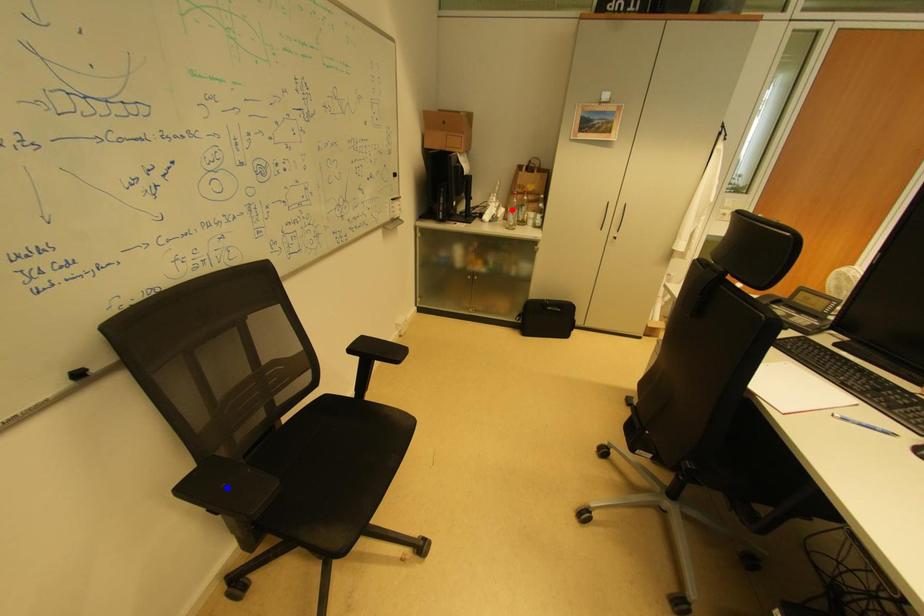
Question: Which of the two points in the image is closer to the camera?

Choices:
 (A) Blue point is closer.
 (B) Red point is closer.

Answer: (A)